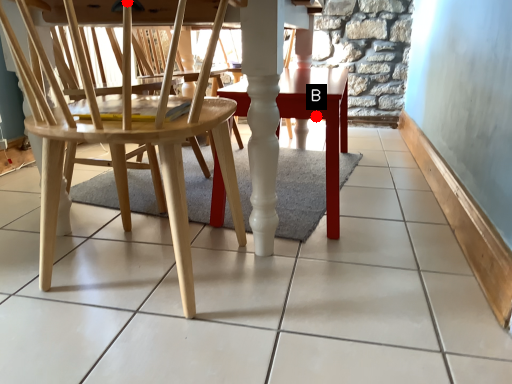
Question: Two points are circled on the image, labeled by A and B beside each circle. Which point appears farthest from the camera in this image?

Choices:
 (A) A is further
 (B) B is further

Answer: (B)